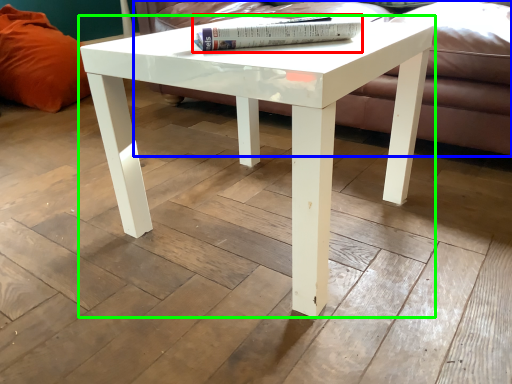
Question: Estimate the real-world distances between objects in this image. Which object is farther from book (highlighted by a red box), couch (highlighted by a blue box) or coffee table (highlighted by a green box)?

Choices:
 (A) couch
 (B) coffee table

Answer: (A)